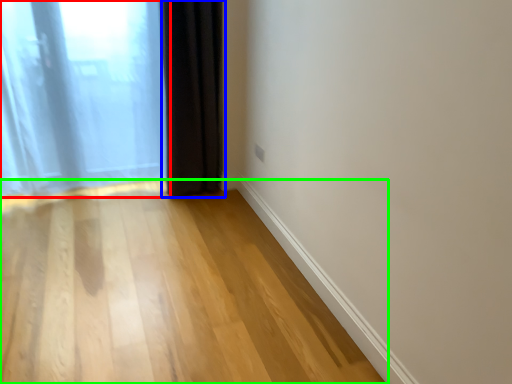
Question: Which is nearer to the curtain (highlighted by a red box)? curtain (highlighted by a blue box) or corridor (highlighted by a green box).

Choices:
 (A) curtain
 (B) corridor

Answer: (A)